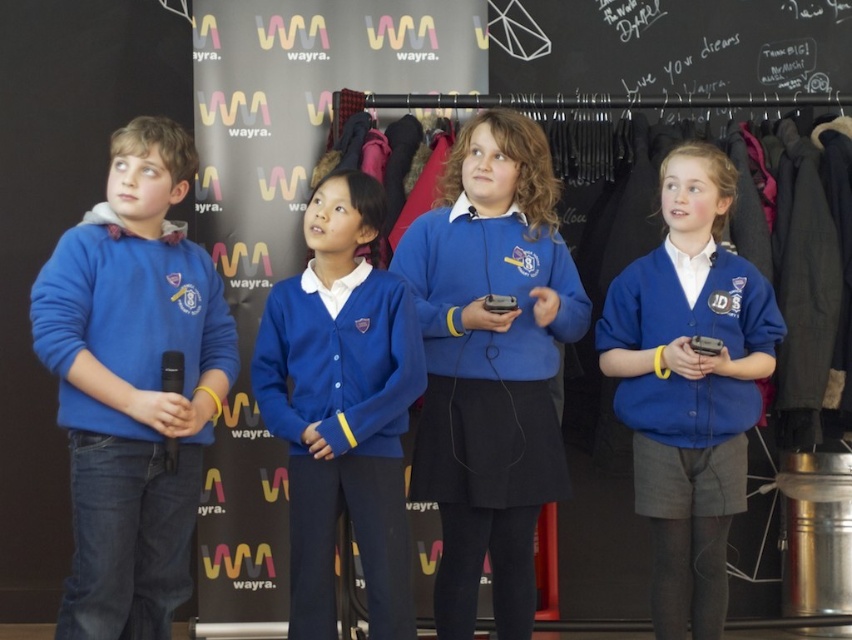
You are a costume designer preparing for a school play and need to ensure the costumes are layered correctly. The blue fabric uniform at center and the blue cardigan at center are part of the costume. According to the image, which item is worn over the other?

The blue cardigan at center is worn over the blue fabric uniform at center because the blue fabric uniform at center is positioned under the blue cardigan at center.

You are organizing a school event and need to determine which clothing item is more suitable for a cold day between the matte blue hoodie at left and the blue cardigan at center. Based on their thickness, which one would you choose?

The blue cardigan at center is thicker than the matte blue hoodie at left, so it would be more suitable for a cold day.